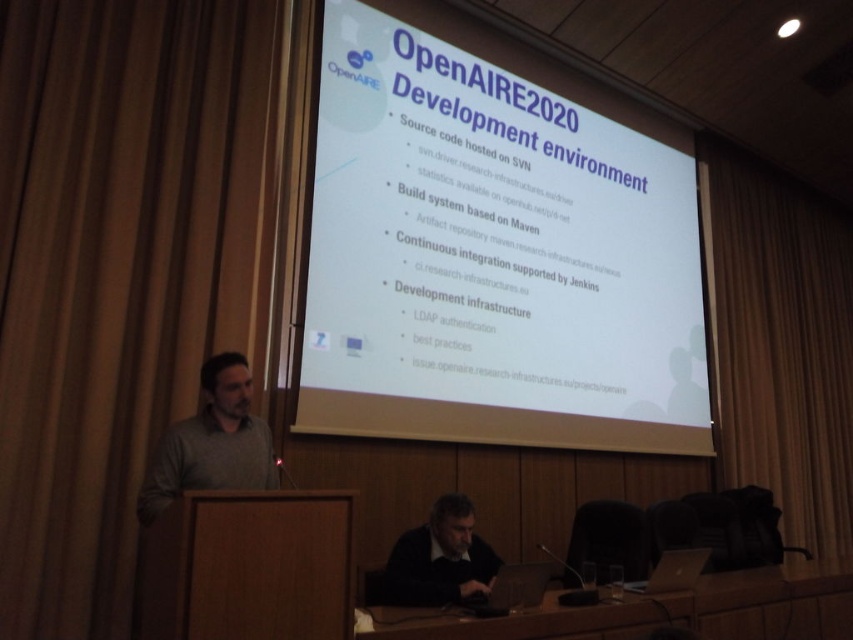
Does brown fabric curtain at left appear on the right side of dark gray sweater at lower center?

Incorrect, brown fabric curtain at left is not on the right side of dark gray sweater at lower center.

Who is positioned more to the left, brown fabric curtain at left or dark gray sweater at lower center?

brown fabric curtain at left

Between point (91, 132) and point (413, 540), which one is positioned in front?

Positioned in front is point (413, 540).

At what (x,y) coordinates should I click in order to perform the action: click on brown fabric curtain at left. Please return your answer as a coordinate pair (x, y). The height and width of the screenshot is (640, 853). Looking at the image, I should click on (115, 272).

Is point (479, 296) behind point (239, 468)?

Yes, it is behind point (239, 468).

Can you confirm if white matte projector screen at center is bigger than gray matte shirt at left?

Yes.

What do you see at coordinates (494, 248) in the screenshot? I see `white matte projector screen at center` at bounding box center [494, 248].

Image resolution: width=853 pixels, height=640 pixels. What are the coordinates of `white matte projector screen at center` in the screenshot? It's located at (494, 248).

Is brown fabric curtain at left smaller than brown fabric curtain at right?

Yes, brown fabric curtain at left is smaller than brown fabric curtain at right.

The image size is (853, 640). What do you see at coordinates (115, 272) in the screenshot? I see `brown fabric curtain at left` at bounding box center [115, 272].

I want to click on brown fabric curtain at left, so click(x=115, y=272).